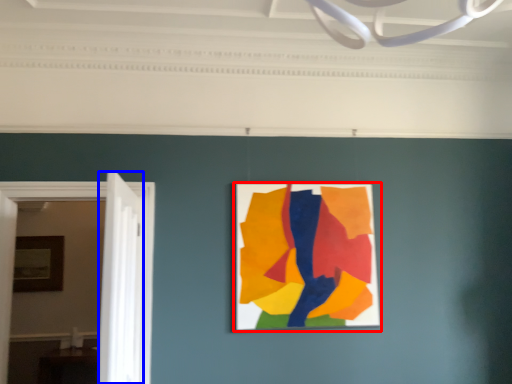
Question: Which of the following is the closest to the observer, picture frame (highlighted by a red box) or door (highlighted by a blue box)?

Choices:
 (A) picture frame
 (B) door

Answer: (B)